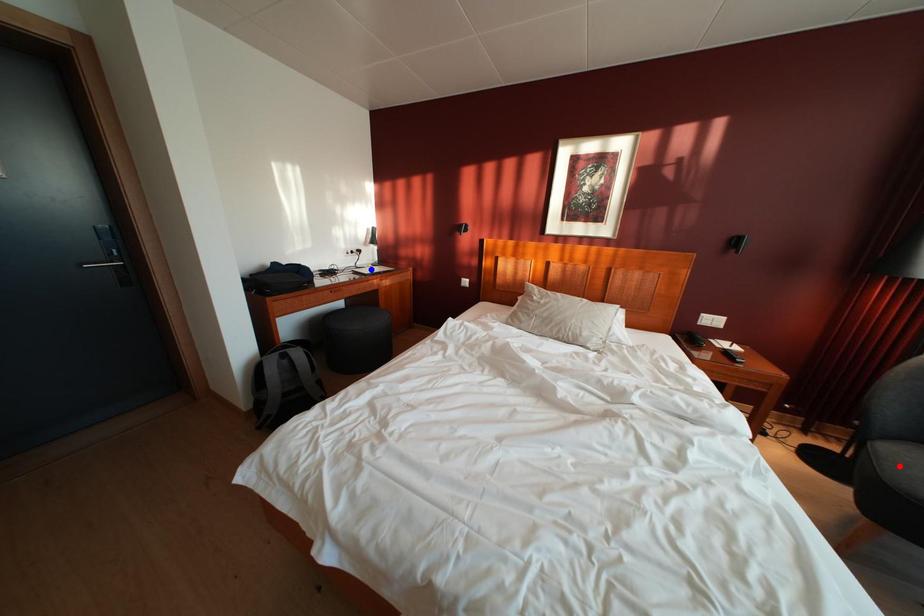
Question: Which of the two points in the image is closer to the camera?

Choices:
 (A) Blue point is closer.
 (B) Red point is closer.

Answer: (B)